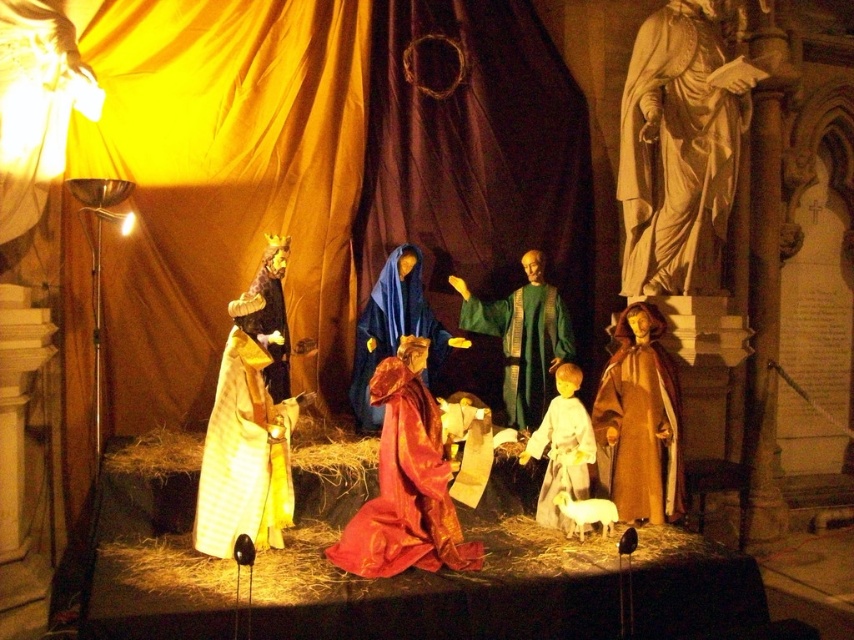
Question: Which object appears farthest from the camera in this image?

Choices:
 (A) white matte robe at center
 (B) shiny red fabric at center
 (C) brown matte robe at lower right

Answer: (C)

Question: Which of the following is the farthest from the observer?

Choices:
 (A) (232, 444)
 (B) (531, 356)

Answer: (B)

Question: Estimate the real-world distances between objects in this image. Which object is farther from the green matte robe at center?

Choices:
 (A) velvet blue robe at center
 (B) beige marble statue at upper right
 (C) brown matte robe at lower right
 (D) gold textured fabric robe at left

Answer: (D)

Question: In this image, where is gold textured fabric robe at left located relative to white matte robe at center?

Choices:
 (A) right
 (B) left

Answer: (B)

Question: Is shiny red fabric at center closer to camera compared to green matte robe at center?

Choices:
 (A) yes
 (B) no

Answer: (A)

Question: Does shiny red fabric at center appear under velvet blue robe at center?

Choices:
 (A) yes
 (B) no

Answer: (A)